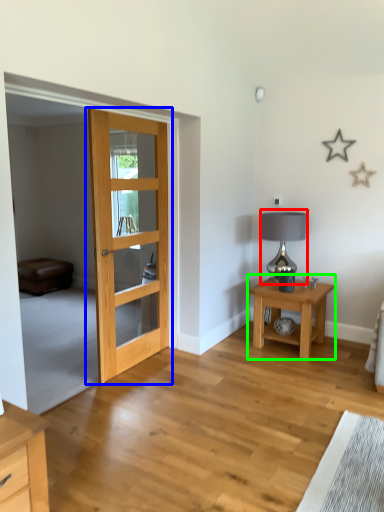
Question: Which object is positioned farthest from table lamp (highlighted by a red box)? Select from door (highlighted by a blue box) and nightstand (highlighted by a green box).

Choices:
 (A) door
 (B) nightstand

Answer: (A)